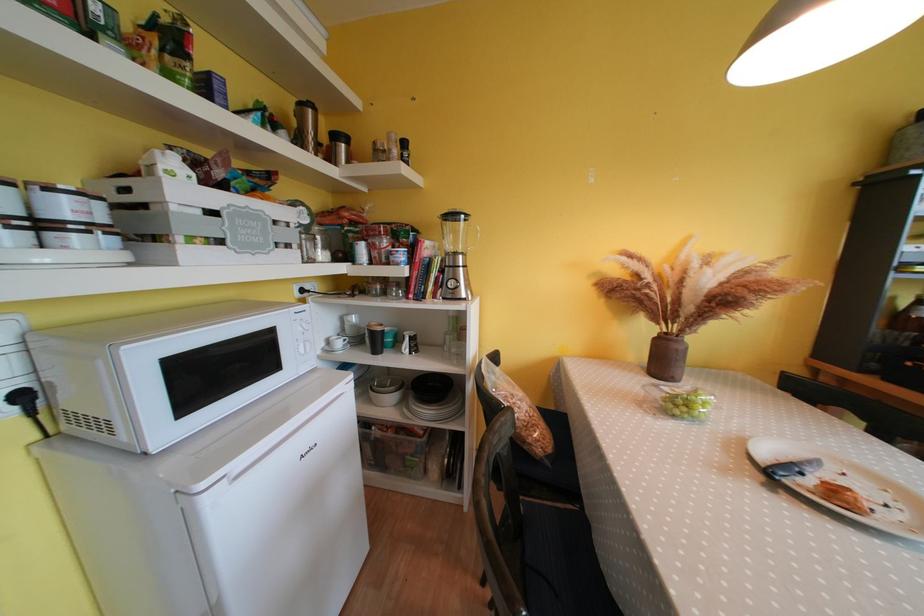
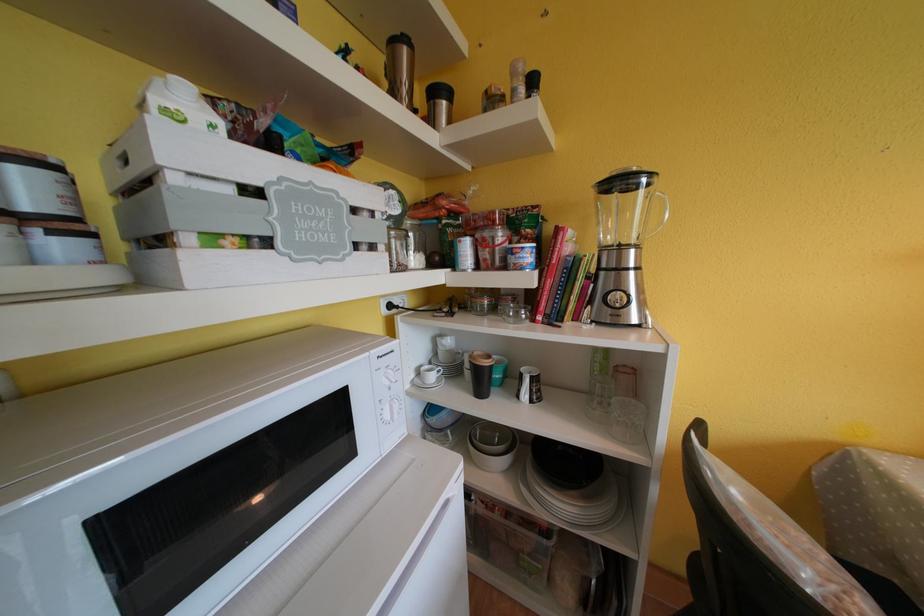
Find the pixel in the second image that matches the point at 342,140 in the first image.

(440, 95)